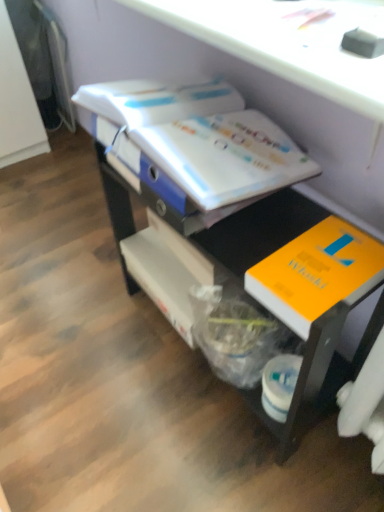
Question: Does white glossy book at upper center, which ranks as the first book in top-to-bottom order, have a greater width compared to matte black drawer at center?

Choices:
 (A) no
 (B) yes

Answer: (A)

Question: Is the depth of white glossy book at upper center, the 2th book ordered from the bottom, greater than that of matte black drawer at center?

Choices:
 (A) no
 (B) yes

Answer: (B)

Question: Is white glossy book at upper center, which ranks as the first book in top-to-bottom order, touching matte black drawer at center?

Choices:
 (A) yes
 (B) no

Answer: (B)

Question: Can you confirm if white glossy book at upper center, the 2th book ordered from the bottom, is thinner than matte black drawer at center?

Choices:
 (A) no
 (B) yes

Answer: (B)

Question: Considering the relative sizes of white glossy book at upper center, the 2th book ordered from the bottom, and matte black drawer at center in the image provided, is white glossy book at upper center, the 2th book ordered from the bottom, smaller than matte black drawer at center?

Choices:
 (A) yes
 (B) no

Answer: (A)

Question: Considering the relative positions of white glossy book at upper center, which ranks as the first book in top-to-bottom order, and matte black drawer at center in the image provided, is white glossy book at upper center, which ranks as the first book in top-to-bottom order, to the right of matte black drawer at center from the viewer's perspective?

Choices:
 (A) no
 (B) yes

Answer: (A)

Question: Can you confirm if orange matte book at lower right, acting as the first book starting from the bottom, is smaller than matte black drawer at center?

Choices:
 (A) yes
 (B) no

Answer: (A)

Question: Considering the relative sizes of orange matte book at lower right, acting as the first book starting from the bottom, and matte black drawer at center in the image provided, is orange matte book at lower right, acting as the first book starting from the bottom, wider than matte black drawer at center?

Choices:
 (A) no
 (B) yes

Answer: (A)

Question: From the image's perspective, is orange matte book at lower right, acting as the first book starting from the bottom, on top of matte black drawer at center?

Choices:
 (A) yes
 (B) no

Answer: (A)

Question: Does orange matte book at lower right, acting as the first book starting from the bottom, turn towards matte black drawer at center?

Choices:
 (A) no
 (B) yes

Answer: (B)

Question: From a real-world perspective, is orange matte book at lower right, acting as the first book starting from the bottom, positioned over matte black drawer at center based on gravity?

Choices:
 (A) no
 (B) yes

Answer: (B)

Question: Is orange matte book at lower right, marked as the 2th book in a top-to-bottom arrangement, to the left of matte black drawer at center from the viewer's perspective?

Choices:
 (A) yes
 (B) no

Answer: (B)

Question: Is orange matte book at lower right, acting as the first book starting from the bottom, not close to white glossy book at upper center, which ranks as the first book in top-to-bottom order?

Choices:
 (A) yes
 (B) no

Answer: (B)